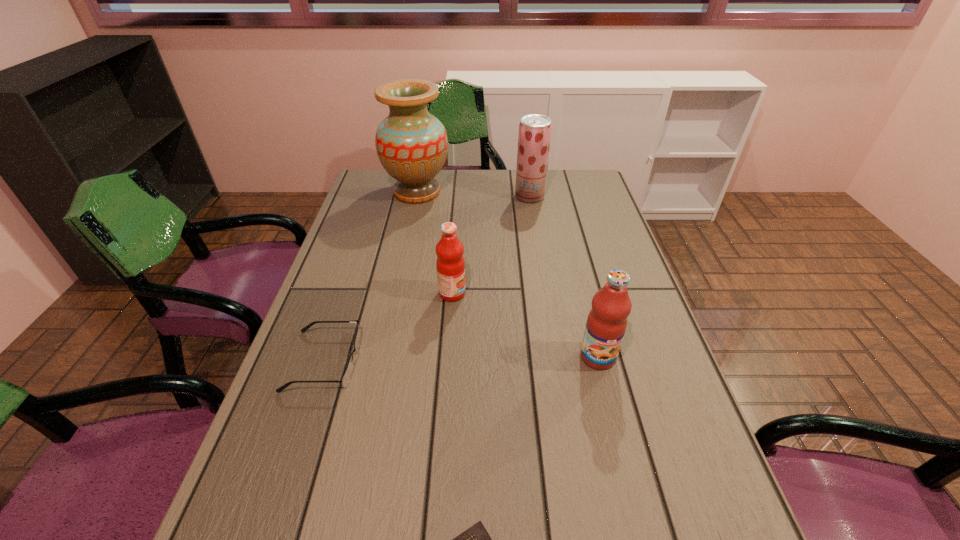
Identify the location of free space located on the front label of the rightmost fruit juice. Image resolution: width=960 pixels, height=540 pixels. (607, 391).

In order to click on vacant space located on the front label of the third farthest object in this screenshot , I will do `click(569, 293)`.

I want to click on vacant area located 0.330m on the front-facing side of the spectacles, so click(505, 361).

Where is `vase present at the far edge`? vase present at the far edge is located at coordinates (412, 145).

Find the location of a particular element. The image size is (960, 540). fruit juice positioned at the far edge is located at coordinates (534, 136).

At what (x,y) coordinates should I click in order to perform the action: click on vase at the left edge. Please return your answer as a coordinate pair (x, y). The height and width of the screenshot is (540, 960). Looking at the image, I should click on (412, 145).

At what (x,y) coordinates should I click in order to perform the action: click on spectacles present at the left edge. Please return your answer as a coordinate pair (x, y). Looking at the image, I should click on (346, 377).

At what (x,y) coordinates should I click in order to perform the action: click on object that is at the right edge. Please return your answer as a coordinate pair (x, y). This screenshot has height=540, width=960. Looking at the image, I should click on (606, 324).

You are a GUI agent. You are given a task and a screenshot of the screen. Output one action in this format:
    pyautogui.click(x=<x>, y=<y>)
    Task: Click on the object present at the far left corner
    The image size is (960, 540).
    Given the screenshot: What is the action you would take?
    pyautogui.click(x=412, y=145)

At what (x,y) coordinates should I click in order to perform the action: click on vacant region at the far edge of the desktop. Please return your answer as a coordinate pair (x, y). Looking at the image, I should click on (505, 170).